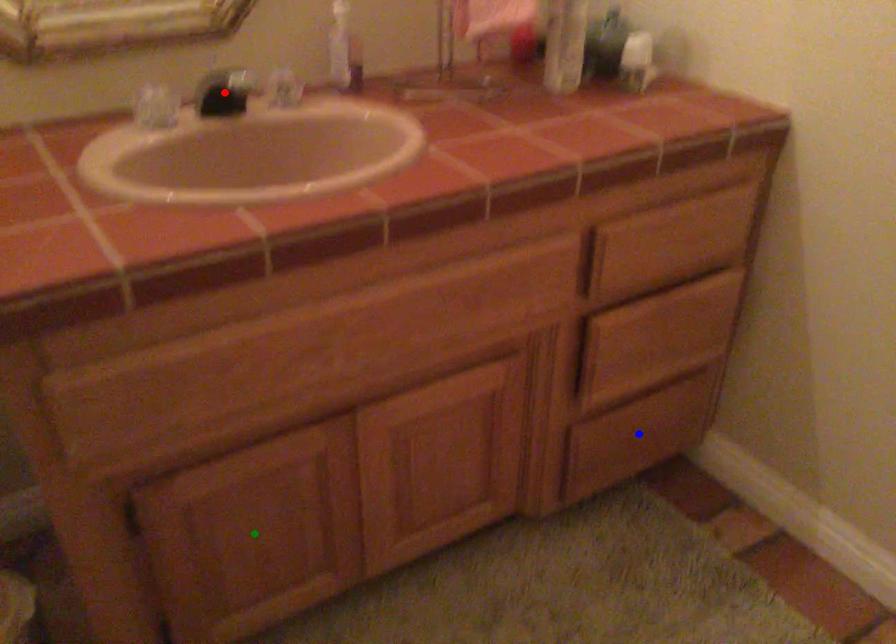
Order these from nearest to farthest:
blue point
green point
red point

red point
green point
blue point